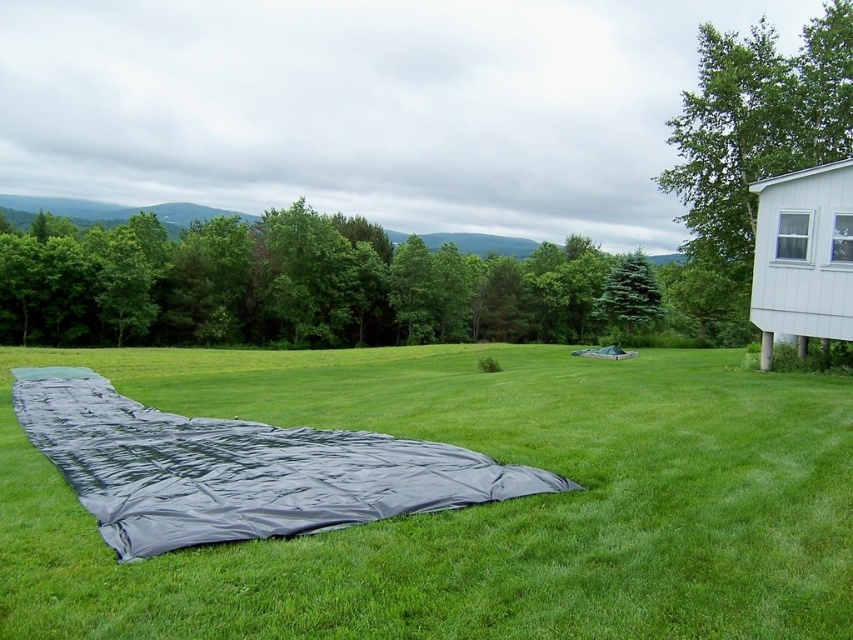
Which is behind, point (254, 458) or point (779, 97)?

Positioned behind is point (779, 97).

Find the location of `black tarp at center`. black tarp at center is located at coordinates [239, 468].

Does black tarp at center appear over green matte evergreen tree at center-right?

Incorrect, black tarp at center is not positioned above green matte evergreen tree at center-right.

Does black tarp at center appear on the left side of green matte evergreen tree at center-right?

Correct, you'll find black tarp at center to the left of green matte evergreen tree at center-right.

Is point (67, 390) positioned after point (637, 264)?

No, it is in front of (637, 264).

At what (x,y) coordinates should I click in order to perform the action: click on black tarp at center. Please return your answer as a coordinate pair (x, y). Looking at the image, I should click on (239, 468).

Is point (753, 236) positioned before point (635, 280)?

Yes, point (753, 236) is in front of point (635, 280).

Find the location of `green leafy tree at upper right`. green leafy tree at upper right is located at coordinates (756, 125).